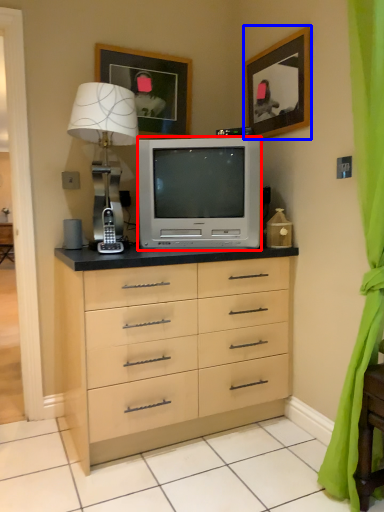
Question: Which point is further to the camera, television (highlighted by a red box) or picture frame (highlighted by a blue box)?

Choices:
 (A) television
 (B) picture frame

Answer: (A)